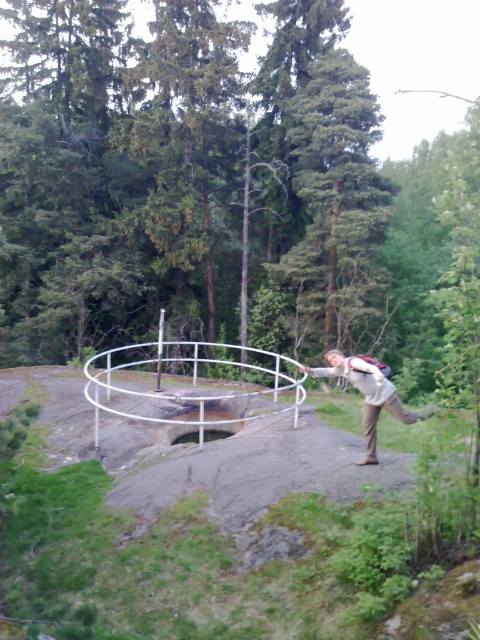
Is point (205, 358) less distant than point (385, 408)?

No, (205, 358) is further to viewer.

Is white metal hula hoop at center positioned at the back of light beige fabric backpack at center?

Yes, it is behind light beige fabric backpack at center.

Which is in front, point (110, 353) or point (372, 448)?

Point (372, 448) is more forward.

At what (x,y) coordinates should I click in order to perform the action: click on white metal hula hoop at center. Please return your answer as a coordinate pair (x, y). Looking at the image, I should click on (192, 385).